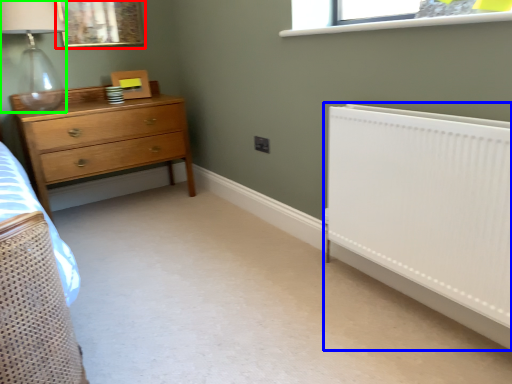
Question: Which object is positioned farthest from picture frame (highlighted by a red box)? Select from radiator (highlighted by a blue box) and lamp (highlighted by a green box).

Choices:
 (A) radiator
 (B) lamp

Answer: (A)